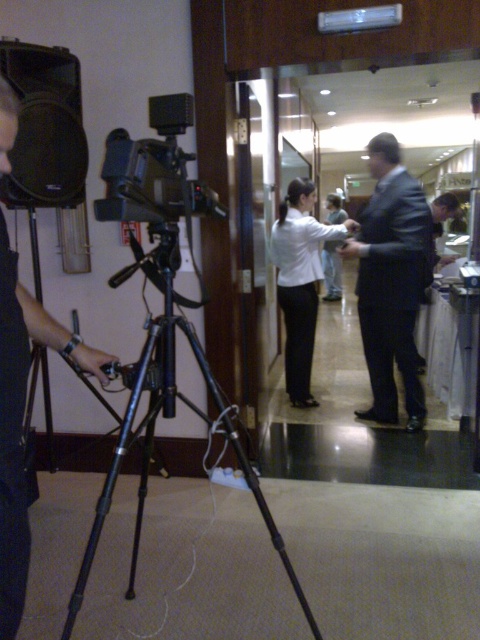
Can you confirm if dark suit at center is thinner than white matte shirt at center?

Incorrect, dark suit at center's width is not less than white matte shirt at center's.

Can you confirm if dark suit at center is positioned below white matte shirt at center?

Yes.

Identify the location of dark suit at center. (391, 282).

Between point (96, 536) and point (287, 348), which one is positioned in front?

Point (96, 536) is in front.

Does black metal tripod at lower left appear over white matte shirt at center?

Incorrect, black metal tripod at lower left is not positioned above white matte shirt at center.

The image size is (480, 640). Identify the location of black metal tripod at lower left. (168, 417).

Between point (333, 234) and point (336, 205), which one is positioned in front?

Point (333, 234)

Between point (330, 230) and point (338, 272), which one is positioned in front?

Point (330, 230)

Find the location of a particular element. white matte shirt at center is located at coordinates (300, 280).